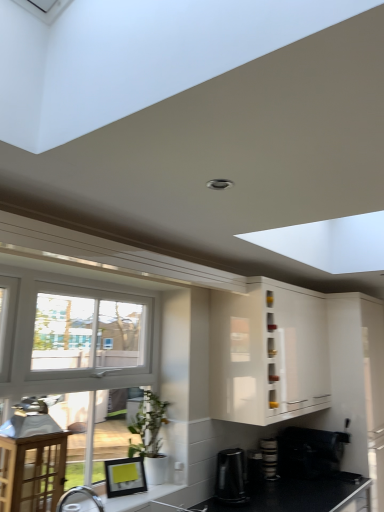
Question: From a real-world perspective, does white glossy cabinet at upper center stand above white matte pot at lower center?

Choices:
 (A) no
 (B) yes

Answer: (B)

Question: Would you say white glossy cabinet at upper center contains white matte pot at lower center?

Choices:
 (A) no
 (B) yes

Answer: (A)

Question: Is white glossy cabinet at upper center looking in the opposite direction of white matte pot at lower center?

Choices:
 (A) yes
 (B) no

Answer: (B)

Question: Is white glossy cabinet at upper center positioned beyond the bounds of white matte pot at lower center?

Choices:
 (A) no
 (B) yes

Answer: (B)

Question: Is white glossy cabinet at upper center thinner than white matte pot at lower center?

Choices:
 (A) no
 (B) yes

Answer: (A)

Question: Can you confirm if white glossy cabinet at upper center is positioned to the left of white matte pot at lower center?

Choices:
 (A) no
 (B) yes

Answer: (A)

Question: Is white glossy countertop at lower left thinner than stacked plates at lower right, which is the 3th appliance from left to right?

Choices:
 (A) yes
 (B) no

Answer: (B)

Question: From a real-world perspective, is white glossy countertop at lower left on stacked plates at lower right, which is the 3th appliance from left to right?

Choices:
 (A) no
 (B) yes

Answer: (A)

Question: Considering the relative sizes of white glossy countertop at lower left and stacked plates at lower right, which is the 3th appliance from left to right, in the image provided, is white glossy countertop at lower left shorter than stacked plates at lower right, which is the 3th appliance from left to right,?

Choices:
 (A) yes
 (B) no

Answer: (A)

Question: Is white glossy countertop at lower left facing towards stacked plates at lower right, which is the 3th appliance from left to right?

Choices:
 (A) yes
 (B) no

Answer: (B)

Question: From the image's perspective, is white glossy countertop at lower left below stacked plates at lower right, which is the 3th appliance from left to right?

Choices:
 (A) yes
 (B) no

Answer: (B)

Question: Is white glossy countertop at lower left further to camera compared to stacked plates at lower right, which appears as the 2th appliance when viewed from the right?

Choices:
 (A) no
 (B) yes

Answer: (A)

Question: Is black matte countertop at lower right outside of white glossy countertop at lower left?

Choices:
 (A) no
 (B) yes

Answer: (B)